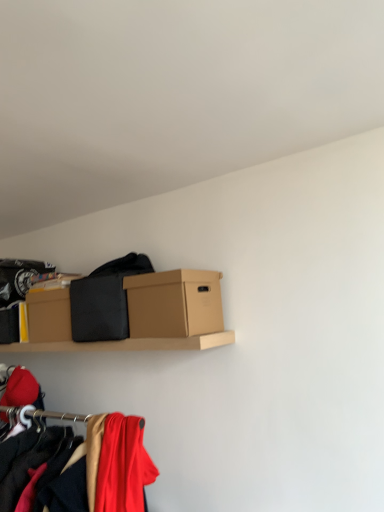
Question: Is brown cardboard box at center facing towards black matte fabric at center, the 1th clothing when ordered from back to front?

Choices:
 (A) yes
 (B) no

Answer: (B)

Question: Does brown cardboard box at center have a smaller size compared to black matte fabric at center, the 1th clothing when ordered from back to front?

Choices:
 (A) yes
 (B) no

Answer: (A)

Question: From a real-world perspective, is brown cardboard box at center positioned under black matte fabric at center, the 1th clothing when ordered from back to front, based on gravity?

Choices:
 (A) yes
 (B) no

Answer: (A)

Question: Can you confirm if brown cardboard box at center is wider than black matte fabric at center, the 1th clothing when ordered from back to front?

Choices:
 (A) yes
 (B) no

Answer: (B)

Question: Is brown cardboard box at center touching black matte fabric at center, the 1th clothing when ordered from back to front?

Choices:
 (A) yes
 (B) no

Answer: (B)

Question: Is point (92, 336) positioned closer to the camera than point (122, 432)?

Choices:
 (A) closer
 (B) farther

Answer: (B)

Question: Is black matte fabric at center, the second clothing in the bottom-to-top sequence, in front of or behind matte red fabric at lower left, the 2th clothing viewed from the top, in the image?

Choices:
 (A) behind
 (B) front

Answer: (A)

Question: From the image's perspective, is black matte fabric at center, which is the 1th clothing from top to bottom, positioned above or below matte red fabric at lower left, marked as the 2th clothing in a back-to-front arrangement?

Choices:
 (A) above
 (B) below

Answer: (A)

Question: Choose the correct answer: Is black matte fabric at center, the 1th clothing when ordered from back to front, inside matte red fabric at lower left, which ranks as the 1th clothing in front-to-back order, or outside it?

Choices:
 (A) inside
 (B) outside

Answer: (B)

Question: Is matte red fabric at lower left, marked as the first clothing in a bottom-to-top arrangement, spatially inside brown cardboard box at center, or outside of it?

Choices:
 (A) outside
 (B) inside

Answer: (A)

Question: Visually, is matte red fabric at lower left, which ranks as the 1th clothing in front-to-back order, positioned to the left or to the right of brown cardboard box at center?

Choices:
 (A) right
 (B) left

Answer: (B)

Question: From a real-world perspective, is matte red fabric at lower left, marked as the first clothing in a bottom-to-top arrangement, positioned above or below brown cardboard box at center?

Choices:
 (A) above
 (B) below

Answer: (B)

Question: In terms of size, does matte red fabric at lower left, marked as the 2th clothing in a back-to-front arrangement, appear bigger or smaller than brown cardboard box at center?

Choices:
 (A) big
 (B) small

Answer: (B)

Question: From the image's perspective, is matte red fabric at lower left, marked as the 2th clothing in a back-to-front arrangement, above or below black matte fabric at center, the second clothing in the bottom-to-top sequence?

Choices:
 (A) below
 (B) above

Answer: (A)

Question: Would you say matte red fabric at lower left, marked as the first clothing in a bottom-to-top arrangement, is to the left or to the right of black matte fabric at center, which is the 1th clothing from top to bottom, in the picture?

Choices:
 (A) right
 (B) left

Answer: (A)